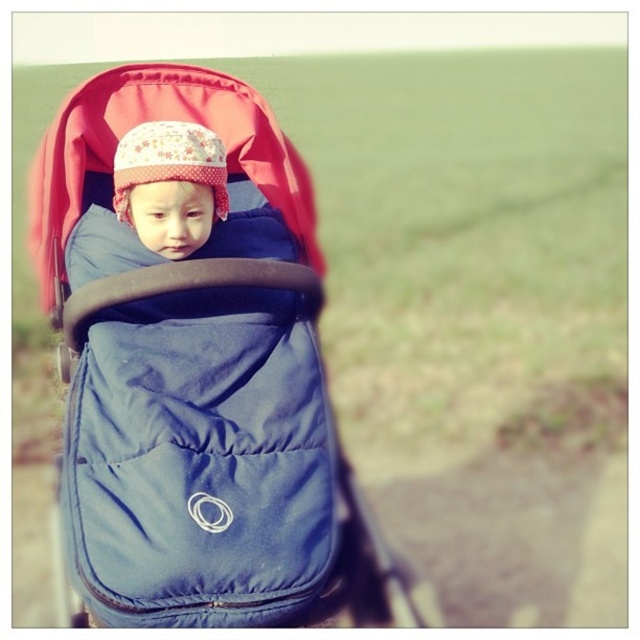
You are a photographer setting up a shot of a baby in a stroller. You want to ensure the blue fabric baby carriage at center and the fluffy fabric hat at center are both in focus. Given their positions, which object should you focus on first to ensure both are sharp?

The blue fabric baby carriage at center is below the fluffy fabric hat at center. To ensure both are in focus, you should focus on the fluffy fabric hat at center first since it is farther away from the camera, allowing the depth of field to cover the closer carriage.

You are a photographer aiming to capture a closeup shot of the blue fabric baby carriage at center. Given that your camera can focus on objects within 5 feet, will you be able to take the photo without moving closer?

The blue fabric baby carriage at center is 6.57 feet from the camera, which is beyond the 5 feet focus range. Therefore, you cannot take the photo without moving closer.